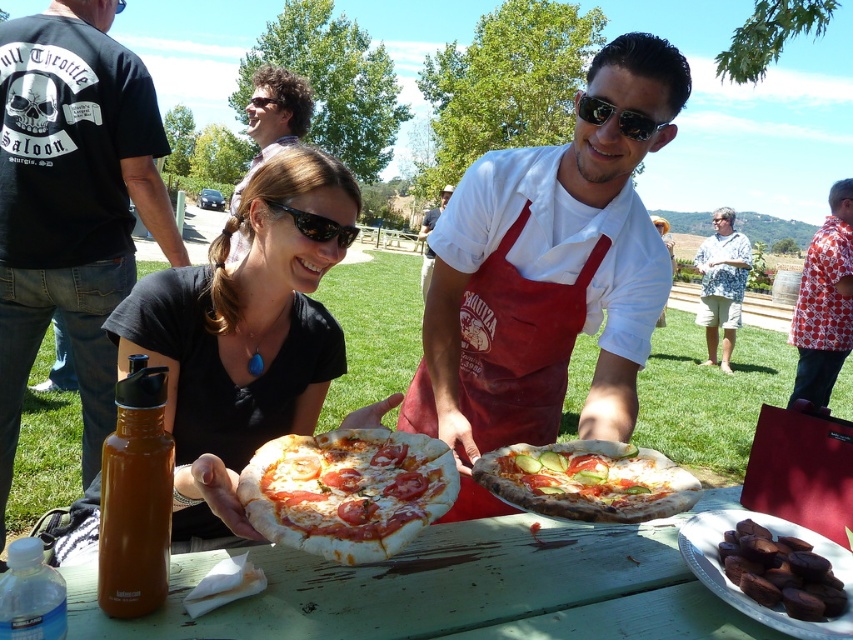
Question: Which point is closer to the camera taking this photo?

Choices:
 (A) (256, 493)
 (B) (271, 216)

Answer: (A)

Question: Can you confirm if black cotton t-shirt at upper left is thinner than white cotton shirt at upper center?

Choices:
 (A) no
 (B) yes

Answer: (B)

Question: Can you confirm if black cotton t-shirt at upper left is positioned below red patterned shirt at center?

Choices:
 (A) no
 (B) yes

Answer: (A)

Question: Which point is closer to the camera?

Choices:
 (A) (820, 355)
 (B) (233, 212)
 (C) (793, 566)

Answer: (C)

Question: Is dark chocolate at lower right further to the viewer compared to curly-haired man at center?

Choices:
 (A) yes
 (B) no

Answer: (B)

Question: Which point is closer to the camera?

Choices:
 (A) floral shirt at center
 (B) tomato sauce pizza at center
 (C) black cotton t-shirt at upper left
 (D) green wood table at center

Answer: (D)